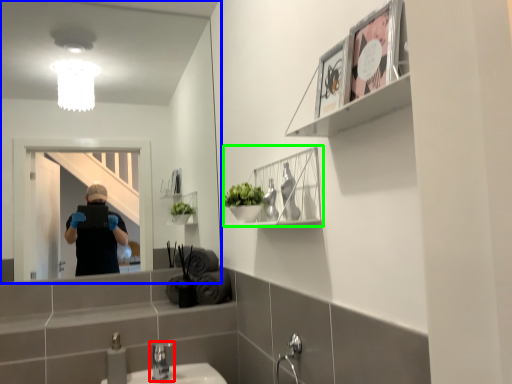
Question: Which is farther away from tap (highlighted by a red box)? mirror (highlighted by a blue box) or cabinet (highlighted by a green box)?

Choices:
 (A) mirror
 (B) cabinet

Answer: (A)